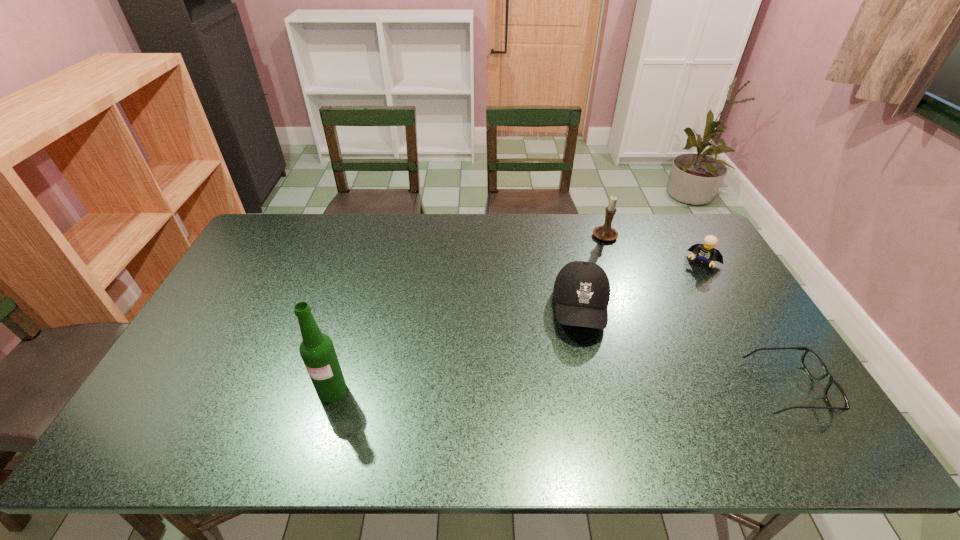
This screenshot has width=960, height=540. I want to click on object that stands as the fourth closest to the third nearest object, so click(x=317, y=350).

This screenshot has width=960, height=540. What are the coordinates of `the closest object relative to the leftmost object` in the screenshot? It's located at (581, 290).

Identify the location of free point that satisfies the following two spatial constraints: 1. on the front side of the third object from right to left; 2. on the front-facing side of the shortest object. (659, 389).

Where is `free spot that satisfies the following two spatial constraints: 1. on the back side of the Lego; 2. on the right side of the second object from left to right`? free spot that satisfies the following two spatial constraints: 1. on the back side of the Lego; 2. on the right side of the second object from left to right is located at coordinates (570, 264).

Where is `vacant region that satisfies the following two spatial constraints: 1. on the front side of the third farthest object; 2. on the front-facing side of the shortest object`? The width and height of the screenshot is (960, 540). vacant region that satisfies the following two spatial constraints: 1. on the front side of the third farthest object; 2. on the front-facing side of the shortest object is located at coordinates (600, 389).